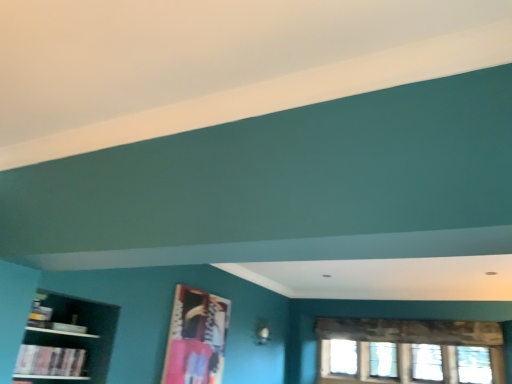
Question: Considering the relative sizes of dark wood shelf at left and metallic silver picture frame at center in the image provided, is dark wood shelf at left shorter than metallic silver picture frame at center?

Choices:
 (A) no
 (B) yes

Answer: (B)

Question: Can you see dark wood shelf at left touching metallic silver picture frame at center?

Choices:
 (A) no
 (B) yes

Answer: (A)

Question: From a real-world perspective, is dark wood shelf at left located higher than metallic silver picture frame at center?

Choices:
 (A) no
 (B) yes

Answer: (A)

Question: Considering the relative positions of dark wood shelf at left and metallic silver picture frame at center in the image provided, is dark wood shelf at left to the right of metallic silver picture frame at center from the viewer's perspective?

Choices:
 (A) yes
 (B) no

Answer: (B)

Question: Is dark wood shelf at left facing away from metallic silver picture frame at center?

Choices:
 (A) no
 (B) yes

Answer: (A)

Question: Would you say dark wood shelf at left is to the left or to the right of clear glass window at lower right in the picture?

Choices:
 (A) right
 (B) left

Answer: (B)

Question: In terms of size, does dark wood shelf at left appear bigger or smaller than clear glass window at lower right?

Choices:
 (A) big
 (B) small

Answer: (B)

Question: Is dark wood shelf at left wider or thinner than clear glass window at lower right?

Choices:
 (A) thin
 (B) wide

Answer: (B)

Question: From the image's perspective, is dark wood shelf at left positioned above or below clear glass window at lower right?

Choices:
 (A) above
 (B) below

Answer: (A)

Question: Is metallic silver picture frame at center to the left or to the right of hardcover book at lower left in the image?

Choices:
 (A) left
 (B) right

Answer: (B)

Question: Would you say metallic silver picture frame at center is inside or outside hardcover book at lower left?

Choices:
 (A) outside
 (B) inside

Answer: (A)

Question: From the image's perspective, is metallic silver picture frame at center positioned above or below hardcover book at lower left?

Choices:
 (A) below
 (B) above

Answer: (A)

Question: Does point (184, 352) appear closer or farther from the camera than point (28, 362)?

Choices:
 (A) closer
 (B) farther

Answer: (B)

Question: Considering the positions of hardcover book at lower left and metallic silver picture frame at center in the image, is hardcover book at lower left bigger or smaller than metallic silver picture frame at center?

Choices:
 (A) big
 (B) small

Answer: (B)

Question: In the image, is hardcover book at lower left positioned in front of or behind metallic silver picture frame at center?

Choices:
 (A) front
 (B) behind

Answer: (A)